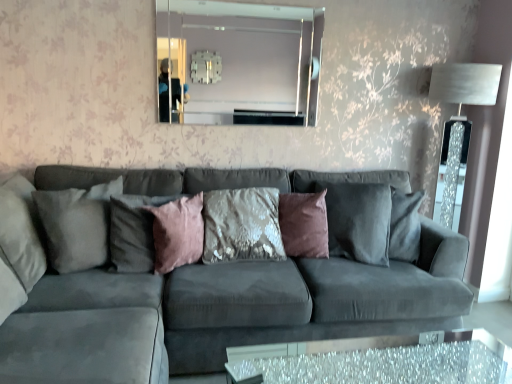
Question: Is suede gray pillow at left, the fourth pillow viewed from the right, aimed at clear glass mirror at upper center?

Choices:
 (A) yes
 (B) no

Answer: (B)

Question: Is suede gray pillow at left, acting as the first pillow starting from the left, not close to clear glass mirror at upper center?

Choices:
 (A) no
 (B) yes

Answer: (B)

Question: From a real-world perspective, is suede gray pillow at left, the fourth pillow viewed from the right, located higher than clear glass mirror at upper center?

Choices:
 (A) no
 (B) yes

Answer: (A)

Question: Is clear glass mirror at upper center inside suede gray pillow at left, acting as the first pillow starting from the left?

Choices:
 (A) yes
 (B) no

Answer: (B)

Question: Is suede gray pillow at left, the fourth pillow viewed from the right, not within clear glass mirror at upper center?

Choices:
 (A) no
 (B) yes

Answer: (B)

Question: In terms of width, does clear glass mirror at upper center look wider or thinner when compared to velvet sequined pillow at center, which is the 1th pillow in right-to-left order?

Choices:
 (A) thin
 (B) wide

Answer: (A)

Question: Is clear glass mirror at upper center in front of or behind velvet sequined pillow at center, which is the 4th pillow from left to right, in the image?

Choices:
 (A) behind
 (B) front

Answer: (A)

Question: Do you think clear glass mirror at upper center is within velvet sequined pillow at center, which is the 1th pillow in right-to-left order, or outside of it?

Choices:
 (A) inside
 (B) outside

Answer: (B)

Question: From a real-world perspective, is clear glass mirror at upper center above or below velvet sequined pillow at center, which is the 4th pillow from left to right?

Choices:
 (A) below
 (B) above

Answer: (B)

Question: In terms of size, does velvet sequined pillow at center, which is the 4th pillow from left to right, appear bigger or smaller than sparkly glass table at lower center?

Choices:
 (A) big
 (B) small

Answer: (B)

Question: From a real-world perspective, is velvet sequined pillow at center, which is the 4th pillow from left to right, above or below sparkly glass table at lower center?

Choices:
 (A) above
 (B) below

Answer: (A)

Question: Considering the relative positions of velvet sequined pillow at center, which is the 4th pillow from left to right, and sparkly glass table at lower center in the image provided, is velvet sequined pillow at center, which is the 4th pillow from left to right, to the left or to the right of sparkly glass table at lower center?

Choices:
 (A) left
 (B) right

Answer: (A)

Question: Is velvet sequined pillow at center, which is the 1th pillow in right-to-left order, inside or outside of sparkly glass table at lower center?

Choices:
 (A) outside
 (B) inside

Answer: (A)

Question: Based on their positions, is clear glass mirror at upper center located to the left or right of pink velvet pillow at center, acting as the third pillow starting from the right?

Choices:
 (A) left
 (B) right

Answer: (B)

Question: In the image, is clear glass mirror at upper center positioned in front of or behind pink velvet pillow at center, the 2th pillow positioned from the left?

Choices:
 (A) front
 (B) behind

Answer: (B)